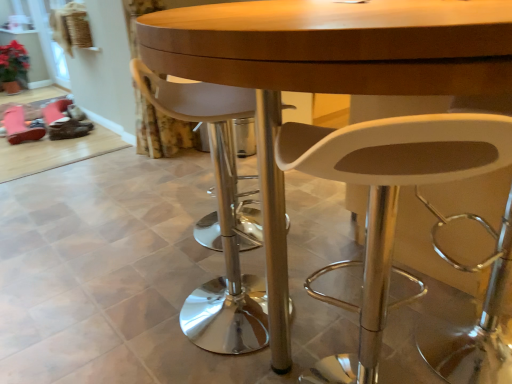
Locate an element on the screen. This screenshot has height=384, width=512. vacant area on the back side of white plastic chair at center, which appears as the second chair when viewed from the left is located at coordinates (348, 332).